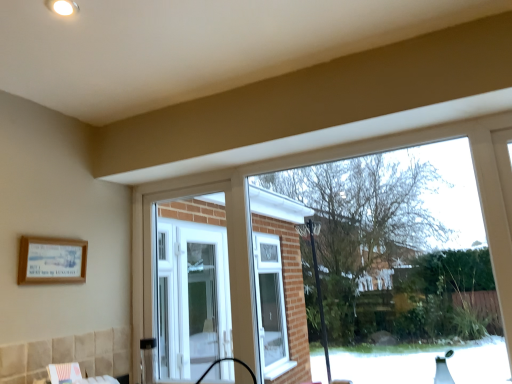
Question: From the image's perspective, is wooden framed poster at lower left positioned above or below white plastic window at center?

Choices:
 (A) below
 (B) above

Answer: (B)

Question: Considering the positions of wooden framed poster at lower left and white plastic window at center in the image, is wooden framed poster at lower left wider or thinner than white plastic window at center?

Choices:
 (A) wide
 (B) thin

Answer: (B)

Question: In the image, is wooden framed poster at lower left positioned in front of or behind white plastic window at center?

Choices:
 (A) behind
 (B) front

Answer: (B)

Question: From the image's perspective, is white plastic window at center located above or below wooden framed poster at lower left?

Choices:
 (A) above
 (B) below

Answer: (B)

Question: Is white plastic window at center bigger or smaller than wooden framed poster at lower left?

Choices:
 (A) big
 (B) small

Answer: (A)

Question: Is white plastic window at center spatially inside wooden framed poster at lower left, or outside of it?

Choices:
 (A) inside
 (B) outside

Answer: (B)

Question: Does point (283, 304) appear closer or farther from the camera than point (76, 256)?

Choices:
 (A) closer
 (B) farther

Answer: (B)